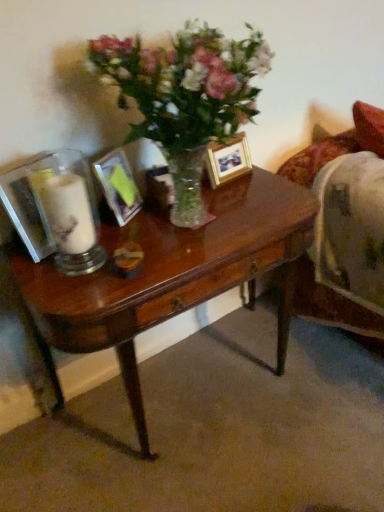
Question: Is wooden photo frame at center, the 2th picture frame positioned from the front, further to the viewer compared to metallic silver picture frame at center, the 1th picture frame viewed from the left?

Choices:
 (A) yes
 (B) no

Answer: (A)

Question: Considering the relative sizes of wooden photo frame at center, which is the first picture frame from back to front, and metallic silver picture frame at center, positioned as the second picture frame in back-to-front order, in the image provided, is wooden photo frame at center, which is the first picture frame from back to front, thinner than metallic silver picture frame at center, positioned as the second picture frame in back-to-front order,?

Choices:
 (A) no
 (B) yes

Answer: (B)

Question: From a real-world perspective, is wooden photo frame at center, the 2th picture frame positioned from the front, over metallic silver picture frame at center, arranged as the first picture frame when viewed from the front?

Choices:
 (A) yes
 (B) no

Answer: (B)

Question: Is wooden photo frame at center, the 2th picture frame positioned from the front, to the left of metallic silver picture frame at center, the 2th picture frame from the right, from the viewer's perspective?

Choices:
 (A) no
 (B) yes

Answer: (A)

Question: Can we say wooden photo frame at center, which is counted as the 1th picture frame, starting from the right, lies outside metallic silver picture frame at center, positioned as the second picture frame in back-to-front order?

Choices:
 (A) no
 (B) yes

Answer: (B)

Question: Is wooden photo frame at center, the 2th picture frame positioned from the front, bigger than metallic silver picture frame at center, arranged as the first picture frame when viewed from the front?

Choices:
 (A) yes
 (B) no

Answer: (B)

Question: Is shiny brown desk at center at the right side of white matte candle at left?

Choices:
 (A) no
 (B) yes

Answer: (B)

Question: Considering the relative positions of shiny brown desk at center and white matte candle at left in the image provided, is shiny brown desk at center to the left of white matte candle at left from the viewer's perspective?

Choices:
 (A) no
 (B) yes

Answer: (A)

Question: Can you confirm if shiny brown desk at center is bigger than white matte candle at left?

Choices:
 (A) yes
 (B) no

Answer: (A)

Question: From the image's perspective, would you say shiny brown desk at center is positioned over white matte candle at left?

Choices:
 (A) no
 (B) yes

Answer: (A)

Question: Is shiny brown desk at center far from white matte candle at left?

Choices:
 (A) yes
 (B) no

Answer: (B)

Question: Is shiny brown desk at center turned away from white matte candle at left?

Choices:
 (A) no
 (B) yes

Answer: (A)

Question: From the image's perspective, does shiny brown desk at center appear lower than metallic silver picture frame at center, the 1th picture frame viewed from the left?

Choices:
 (A) no
 (B) yes

Answer: (B)